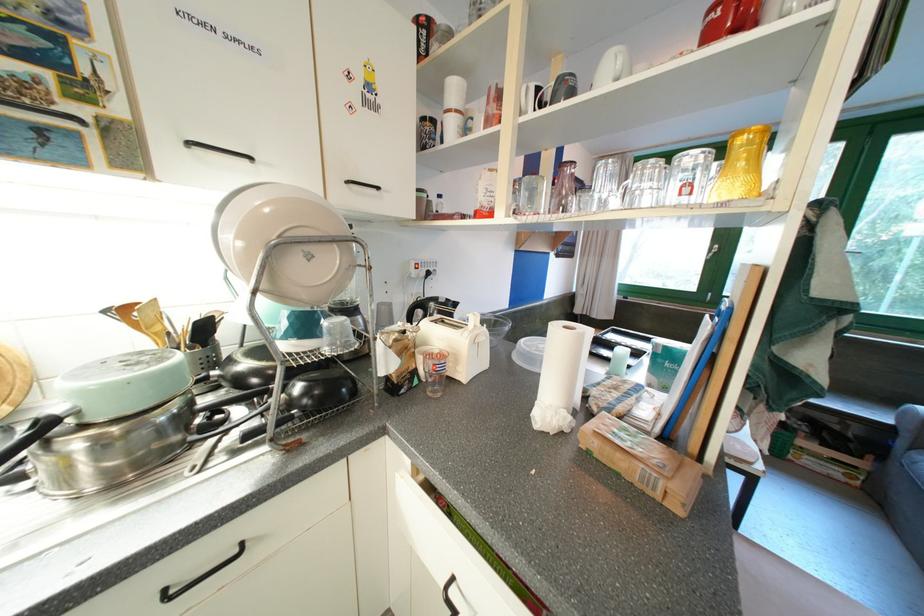
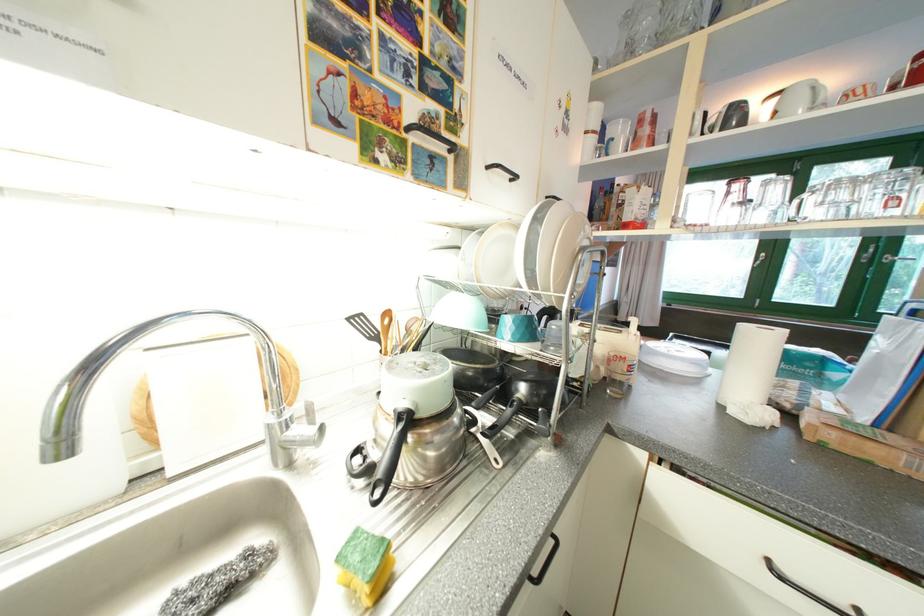
Question: How did the camera likely rotate?

Choices:
 (A) Left
 (B) Right
 (C) Up
 (D) Down

Answer: (C)